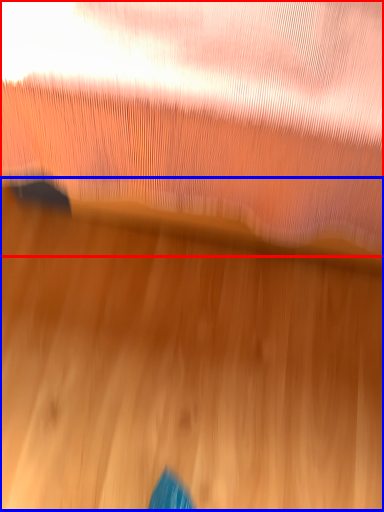
Question: Which point is further to the camera, curtain (highlighted by a red box) or wood (highlighted by a blue box)?

Choices:
 (A) curtain
 (B) wood

Answer: (B)